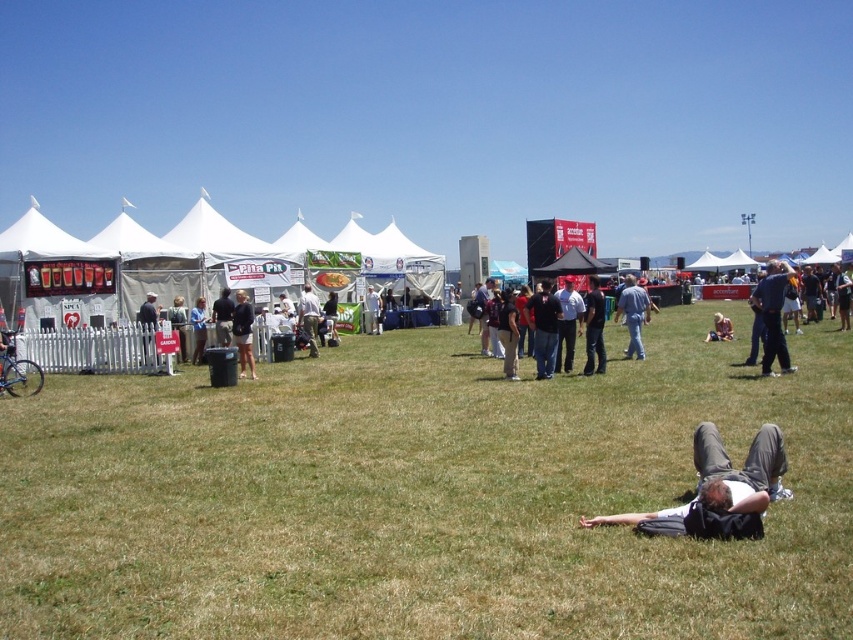
Question: Which of the following is the farthest from the observer?

Choices:
 (A) dark gray pants at lower right
 (B) blue denim shirt at center

Answer: (B)

Question: Which object appears farthest from the camera in this image?

Choices:
 (A) dark red shirt at center
 (B) jeans at center
 (C) dark gray shorts at center
 (D) dark blue jeans at center

Answer: (B)

Question: Which object is closer to the camera taking this photo?

Choices:
 (A) light brown hair at lower right
 (B) jeans at center
 (C) green grass at center
 (D) dark blue jeans at center

Answer: (C)

Question: Does dark blue jeans at center appear under light brown hair at lower right?

Choices:
 (A) no
 (B) yes

Answer: (A)

Question: From the image, what is the correct spatial relationship of dark gray pants at lower right in relation to dark blue jeans at center?

Choices:
 (A) below
 (B) above

Answer: (A)

Question: Can you confirm if dark gray hoodie at center is positioned to the right of dark gray shorts at center?

Choices:
 (A) no
 (B) yes

Answer: (B)